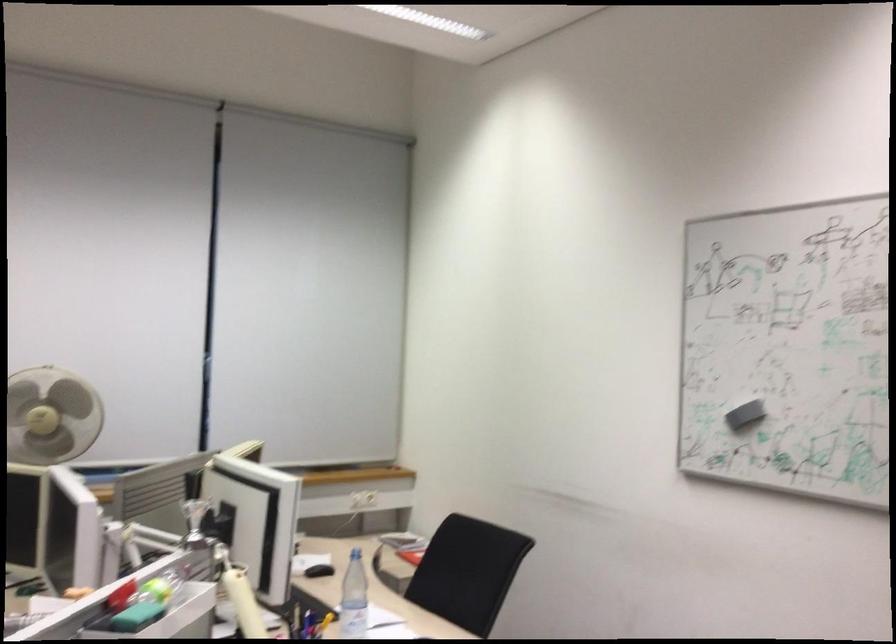
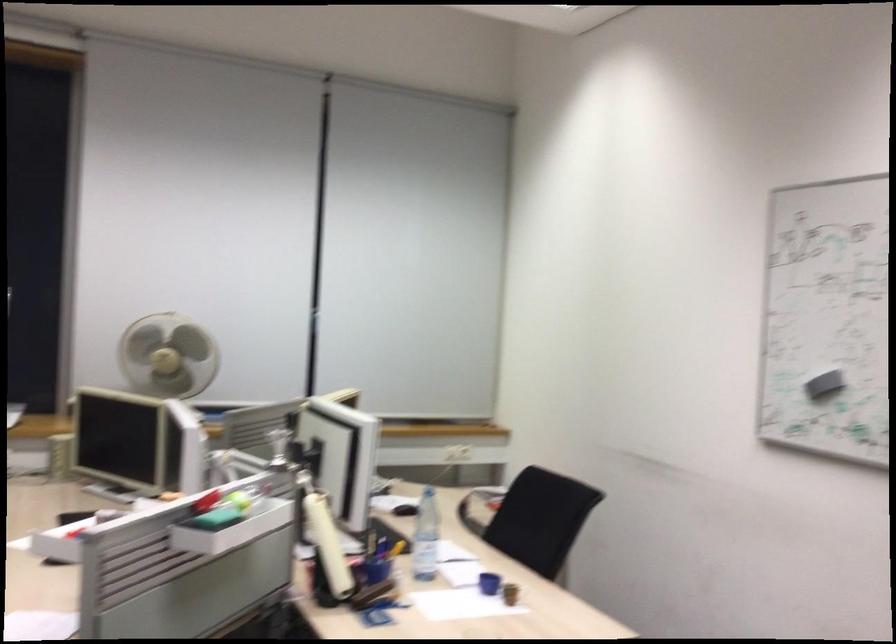
Question: Based on the continuous images, in which direction is the camera rotating? Reply with the corresponding letter.

Choices:
 (A) Left
 (B) Right
 (C) Up
 (D) Down

Answer: (A)